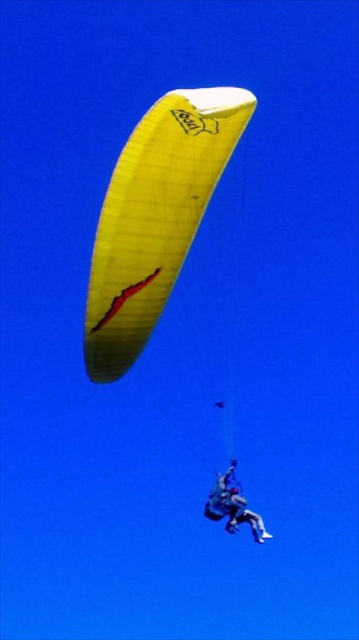
Question: Can you confirm if yellow mesh parachute at upper center is positioned above matte blue jumpsuit at center?

Choices:
 (A) no
 (B) yes

Answer: (B)

Question: Which of the following is the farthest from the observer?

Choices:
 (A) yellow mesh parachute at upper center
 (B) matte blue jumpsuit at center

Answer: (B)

Question: Does yellow mesh parachute at upper center appear over matte blue jumpsuit at center?

Choices:
 (A) no
 (B) yes

Answer: (B)

Question: Does yellow mesh parachute at upper center have a larger size compared to matte blue jumpsuit at center?

Choices:
 (A) no
 (B) yes

Answer: (B)

Question: Which of the following is the closest to the observer?

Choices:
 (A) yellow mesh parachute at upper center
 (B) matte blue jumpsuit at center

Answer: (A)